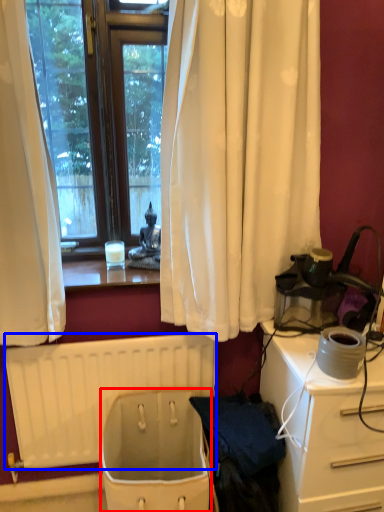
Question: Which object is further to the camera taking this photo, toilet bowl (highlighted by a red box) or radiator (highlighted by a blue box)?

Choices:
 (A) toilet bowl
 (B) radiator

Answer: (B)